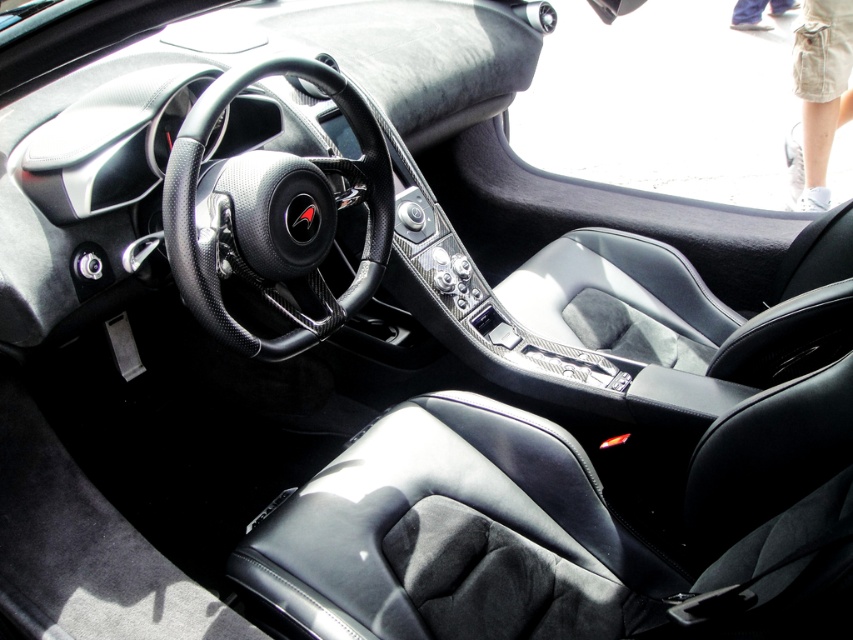
You are a mechanic working on the car and need to place a tool that is 1 meter long between the two points marked as point (x=170, y=268). Will the tool fit between them?

The distance between the two points marked as point (x=170, y=268) is 1.13 meters, which is longer than the tool of 1 meter. Therefore, the tool will fit between them.

You are sitting in the driver seat of the sports car and need to reach two points inside the car. The first point is at coordinate point(259, 163) and the second is at point(801, 90). Which point is closer to you?

Point(259, 163) is in front of point(801, 90), so the first point is closer to you.

You are sitting in the driver seat of the car and want to reach the carbon fiber steering wheel at center and the black leather seat at center. Which object is closer to your right hand?

The black leather seat at center is closer to your right hand because the carbon fiber steering wheel at center is positioned on the left side of it.